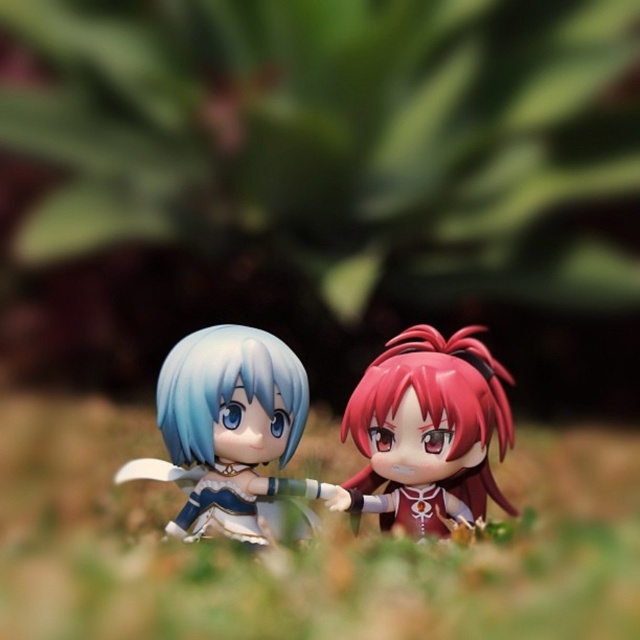
You are a collector who wants to display both the green grass at center and the satin red hair at center in a showcase. Which object should you place first to ensure the smaller one is visible?

The satin red hair at center is smaller than the green grass at center, so you should place the satin red hair at center first to ensure it is visible over the larger green grass at center.